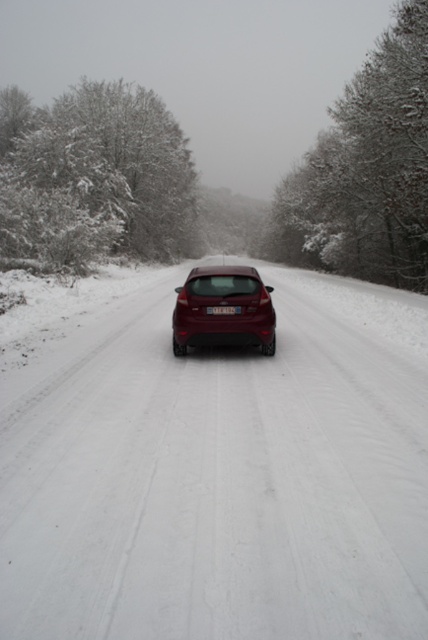
Who is positioned more to the left, white powdery snow at center or glossy metallic hatchback at center?

Positioned to the left is glossy metallic hatchback at center.

Which of these two, white powdery snow at center or glossy metallic hatchback at center, stands shorter?

glossy metallic hatchback at center

Is point (32, 529) behind point (189, 316)?

No, (32, 529) is closer to viewer.

Find the location of a particular element. white powdery snow at center is located at coordinates (217, 468).

Which is in front, point (35, 604) or point (363, 115)?

Point (35, 604)

Who is more distant from viewer, [36,320] or [366,268]?

Point [366,268]

I want to click on white powdery snow at center, so click(x=217, y=468).

Can you confirm if snow-covered tree at left is positioned to the right of snow-covered trees at upper center?

No, snow-covered tree at left is not to the right of snow-covered trees at upper center.

Which is below, snow-covered tree at left or snow-covered trees at upper center?

snow-covered tree at left is lower down.

Between point (74, 168) and point (353, 232), which one is positioned in front?

Point (74, 168)

This screenshot has height=640, width=428. What are the coordinates of `snow-covered tree at left` in the screenshot? It's located at (95, 179).